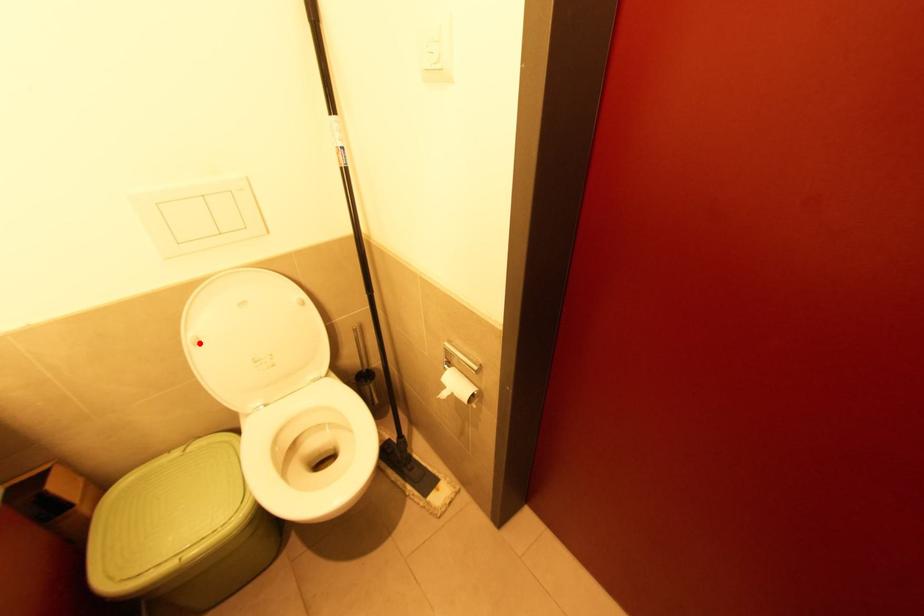
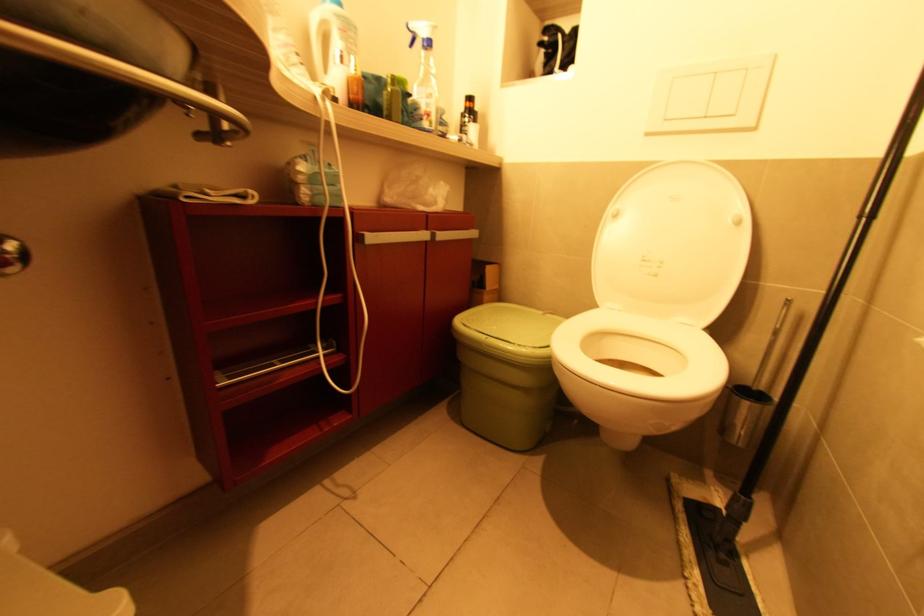
Find the pixel in the second image that matches the highlighted location in the first image.

(617, 217)